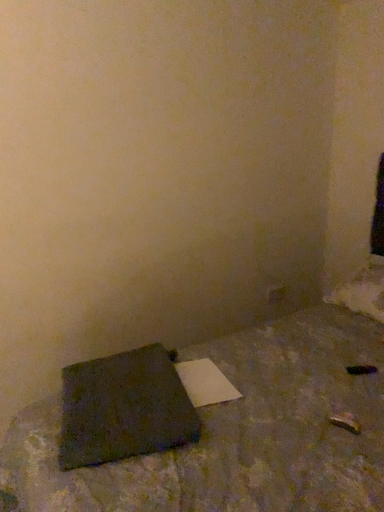
The width and height of the screenshot is (384, 512). In order to click on dark gray fabric notebook at lower left in this screenshot , I will do `click(124, 408)`.

Measure the distance between point (120, 417) and camera.

A distance of 1.24 meters exists between point (120, 417) and camera.

What do you see at coordinates (124, 408) in the screenshot? I see `dark gray fabric notebook at lower left` at bounding box center [124, 408].

What do you see at coordinates (238, 433) in the screenshot?
I see `dark gray fabric cushion at lower left` at bounding box center [238, 433].

You are a GUI agent. You are given a task and a screenshot of the screen. Output one action in this format:
    pyautogui.click(x=<x>, y=<y>)
    Task: Click on the dark gray fabric cushion at lower left
    The width and height of the screenshot is (384, 512).
    Given the screenshot: What is the action you would take?
    pyautogui.click(x=238, y=433)

Measure the distance between dark gray fabric cushion at lower left and camera.

The depth of dark gray fabric cushion at lower left is 1.00 meters.

Locate an element on the screen. The width and height of the screenshot is (384, 512). dark gray fabric notebook at lower left is located at coordinates (124, 408).

Does dark gray fabric notebook at lower left appear on the left side of dark gray fabric cushion at lower left?

Yes, dark gray fabric notebook at lower left is to the left of dark gray fabric cushion at lower left.

Which is behind, dark gray fabric notebook at lower left or dark gray fabric cushion at lower left?

dark gray fabric notebook at lower left is more distant.

Is point (154, 353) positioned in front of point (366, 490)?

No, (154, 353) is further to viewer.

From the image's perspective, is dark gray fabric notebook at lower left above or below dark gray fabric cushion at lower left?

From the image's perspective, dark gray fabric notebook at lower left appears below dark gray fabric cushion at lower left.

From a real-world perspective, is dark gray fabric notebook at lower left positioned over dark gray fabric cushion at lower left based on gravity?

No, from a real-world perspective, dark gray fabric notebook at lower left is not over dark gray fabric cushion at lower left

Does dark gray fabric notebook at lower left have a greater width compared to dark gray fabric cushion at lower left?

No, dark gray fabric notebook at lower left is not wider than dark gray fabric cushion at lower left.

Which of these two, dark gray fabric notebook at lower left or dark gray fabric cushion at lower left, stands shorter?

With less height is dark gray fabric notebook at lower left.

Is dark gray fabric notebook at lower left bigger or smaller than dark gray fabric cushion at lower left?

dark gray fabric notebook at lower left is smaller than dark gray fabric cushion at lower left.

Do you think dark gray fabric notebook at lower left is within dark gray fabric cushion at lower left, or outside of it?

dark gray fabric notebook at lower left is located inside dark gray fabric cushion at lower left.

Is dark gray fabric notebook at lower left in contact with dark gray fabric cushion at lower left?

No, dark gray fabric notebook at lower left is not in contact with dark gray fabric cushion at lower left.

Is dark gray fabric notebook at lower left aimed at dark gray fabric cushion at lower left?

Yes, dark gray fabric notebook at lower left is oriented towards dark gray fabric cushion at lower left.

Identify the location of furniture in front of the dark gray fabric notebook at lower left. (238, 433).

Considering the relative positions of dark gray fabric cushion at lower left and dark gray fabric notebook at lower left in the image provided, is dark gray fabric cushion at lower left to the right of dark gray fabric notebook at lower left from the viewer's perspective?

Yes, dark gray fabric cushion at lower left is to the right of dark gray fabric notebook at lower left.

Between dark gray fabric cushion at lower left and dark gray fabric notebook at lower left, which one is positioned behind?

dark gray fabric notebook at lower left.

Which is in front, point (361, 433) or point (169, 389)?

The point (361, 433) is closer to the camera.

From the image's perspective, is dark gray fabric cushion at lower left located beneath dark gray fabric notebook at lower left?

No, from the image's perspective, dark gray fabric cushion at lower left is not beneath dark gray fabric notebook at lower left.

From a real-world perspective, is dark gray fabric cushion at lower left on top of dark gray fabric notebook at lower left?

Correct, in the physical world, dark gray fabric cushion at lower left is higher than dark gray fabric notebook at lower left.

In terms of width, does dark gray fabric cushion at lower left look wider or thinner when compared to dark gray fabric notebook at lower left?

In the image, dark gray fabric cushion at lower left appears to be wider than dark gray fabric notebook at lower left.

Considering the relative sizes of dark gray fabric cushion at lower left and dark gray fabric notebook at lower left in the image provided, is dark gray fabric cushion at lower left shorter than dark gray fabric notebook at lower left?

In fact, dark gray fabric cushion at lower left may be taller than dark gray fabric notebook at lower left.

Considering the sizes of dark gray fabric cushion at lower left and dark gray fabric notebook at lower left in the image, is dark gray fabric cushion at lower left bigger or smaller than dark gray fabric notebook at lower left?

In the image, dark gray fabric cushion at lower left appears to be larger than dark gray fabric notebook at lower left.

Can we say dark gray fabric cushion at lower left lies outside dark gray fabric notebook at lower left?

That's correct, dark gray fabric cushion at lower left is outside of dark gray fabric notebook at lower left.

In the scene shown: Is dark gray fabric cushion at lower left not near dark gray fabric notebook at lower left?

No, dark gray fabric cushion at lower left is not far away from dark gray fabric notebook at lower left.

Does dark gray fabric cushion at lower left turn towards dark gray fabric notebook at lower left?

Yes.

How far apart are dark gray fabric cushion at lower left and dark gray fabric notebook at lower left?

They are 19.97 centimeters apart.

You are a GUI agent. You are given a task and a screenshot of the screen. Output one action in this format:
    pyautogui.click(x=<x>, y=<y>)
    Task: Click on the notebook below the dark gray fabric cushion at lower left (from the image's perspective)
    
    Given the screenshot: What is the action you would take?
    pyautogui.click(x=124, y=408)

Find the location of a particular element. notebook located on the left of dark gray fabric cushion at lower left is located at coordinates (124, 408).

Where is `furniture that appears above the dark gray fabric notebook at lower left (from the image's perspective)`? furniture that appears above the dark gray fabric notebook at lower left (from the image's perspective) is located at coordinates (238, 433).